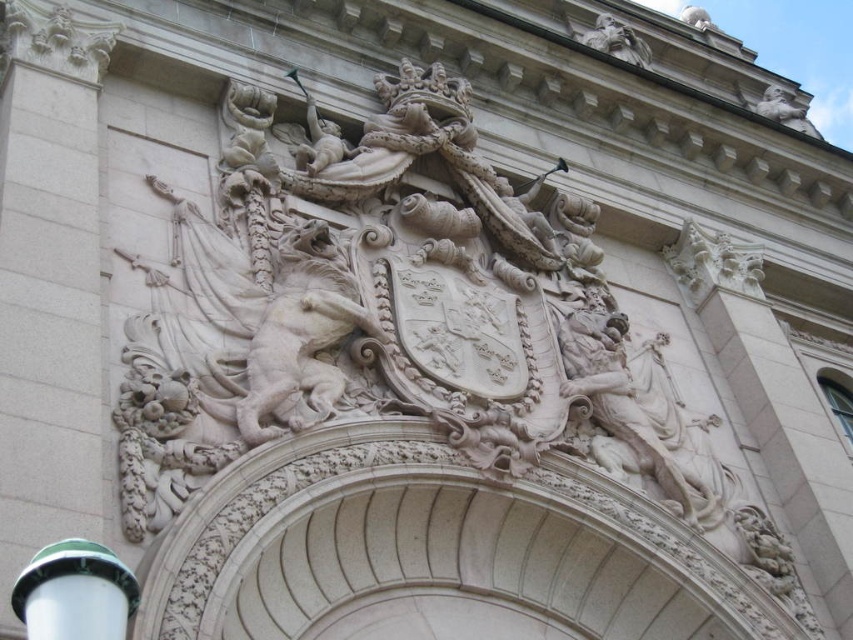
You are a tour guide explaining the historical site to visitors. You want to mention the distance between the white stone coat of arms at center and the green plastic lamp post at lower left. Can you confirm if the distance is more than 20 meters?

The white stone coat of arms at center is 26.24 meters from the green plastic lamp post at lower left, so yes, the distance is more than 20 meters.

You are an architect examining the historical building facade. You notice a point marked at coordinates (393, 316). Based on the scene, what does this point likely indicate?

The point at coordinates (393, 316) marks the white stone coat of arms at center, which is the central shield adorned with symbols like a crown, indicating a royal or noble association.